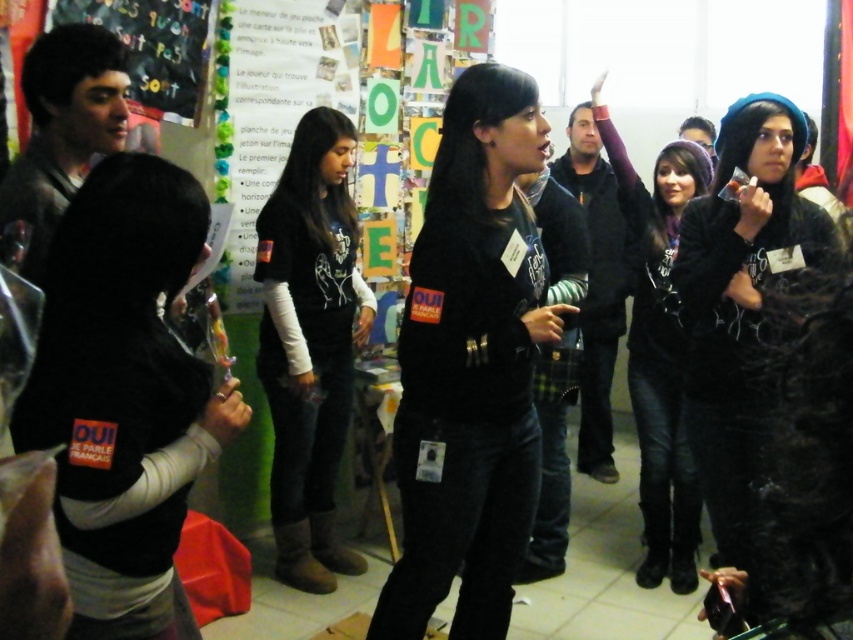
Question: Can you confirm if black matte shirt at center is wider than black leather jacket at upper right?

Choices:
 (A) no
 (B) yes

Answer: (B)

Question: Among these objects, which one is farthest from the camera?

Choices:
 (A) black matte shirt at center
 (B) black matte vest at lower left

Answer: (A)

Question: Which object is the closest to the shiny black jacket at left?

Choices:
 (A) dark brown leather boots at center
 (B) dark blue jacket at center
 (C) black matte vest at lower left
 (D) black leather jacket at upper right

Answer: (C)

Question: Can you confirm if dark blue jacket at center is positioned to the left of matte black chalkboard at upper left?

Choices:
 (A) no
 (B) yes

Answer: (A)

Question: Observing the image, what is the correct spatial positioning of black leather jacket at upper right in reference to dark blue jacket at center?

Choices:
 (A) above
 (B) below

Answer: (B)

Question: Which of these objects is positioned farthest from the black matte shirt at center?

Choices:
 (A) dark blue jacket at center
 (B) matte black chalkboard at upper left

Answer: (A)